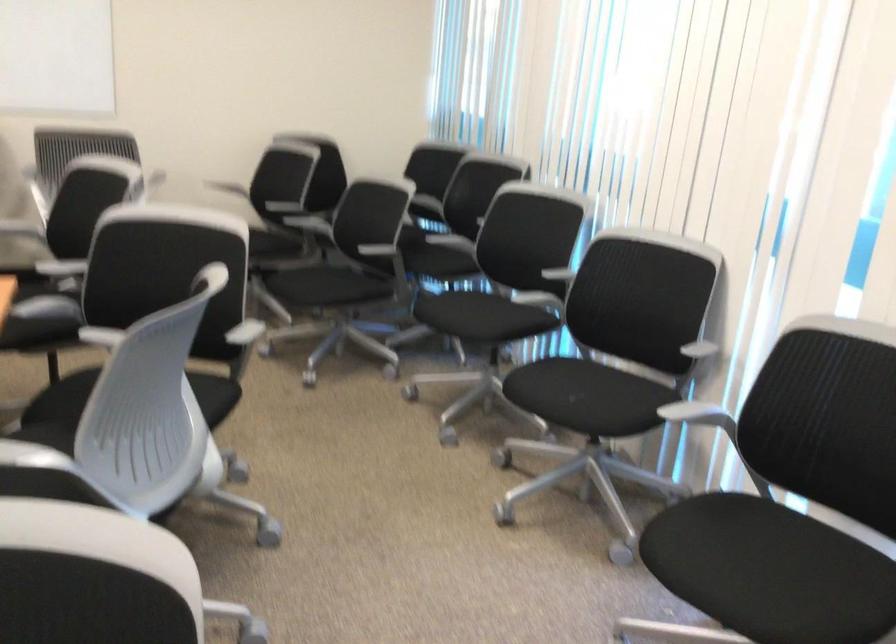
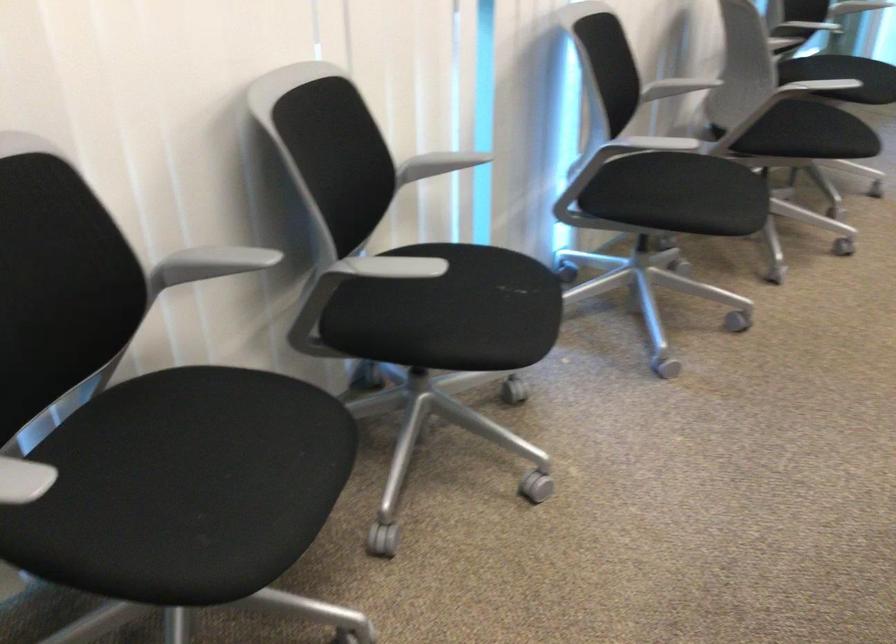
Find the pixel in the second image that matches the point at 569,409 in the first image.

(515, 287)